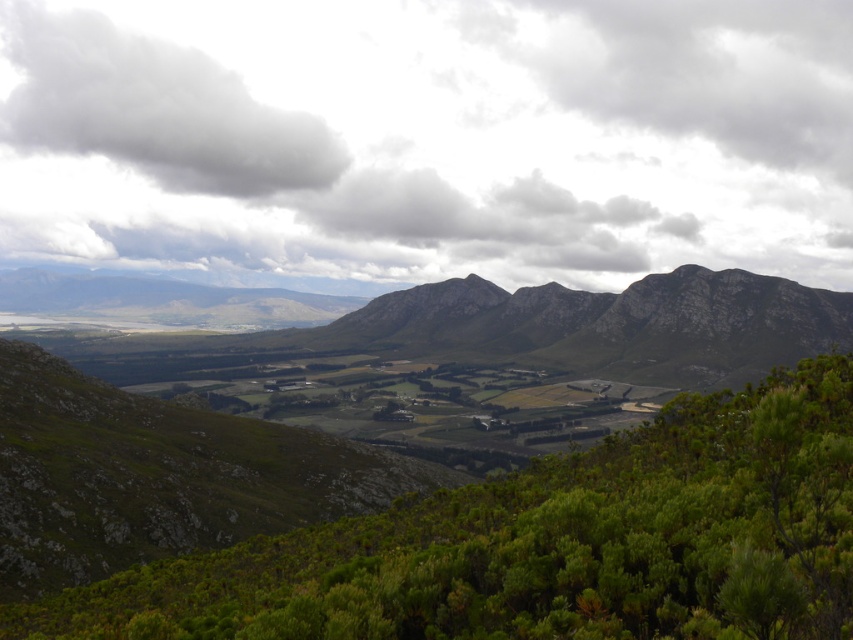
Question: Estimate the real-world distances between objects in this image. Which object is closer to the cloudy sky at upper center?

Choices:
 (A) green rough rock at center
 (B) green leafy shrub at lower center
 (C) white fluffy cloud at upper left

Answer: (C)

Question: Is cloudy sky at upper center above green rough rock at center?

Choices:
 (A) no
 (B) yes

Answer: (B)

Question: Considering the relative positions of cloudy sky at upper center and white fluffy cloud at upper left in the image provided, where is cloudy sky at upper center located with respect to white fluffy cloud at upper left?

Choices:
 (A) above
 (B) below

Answer: (B)

Question: Is green leafy shrub at lower center positioned behind green rough rock at center?

Choices:
 (A) yes
 (B) no

Answer: (B)

Question: Estimate the real-world distances between objects in this image. Which object is farther from the green leafy shrub at lower center?

Choices:
 (A) white fluffy cloud at upper left
 (B) cloudy sky at upper center
 (C) green rough rock at center

Answer: (A)

Question: Which point is farther to the camera?

Choices:
 (A) green rough rock at center
 (B) cloudy sky at upper center
 (C) green leafy shrub at lower center

Answer: (B)